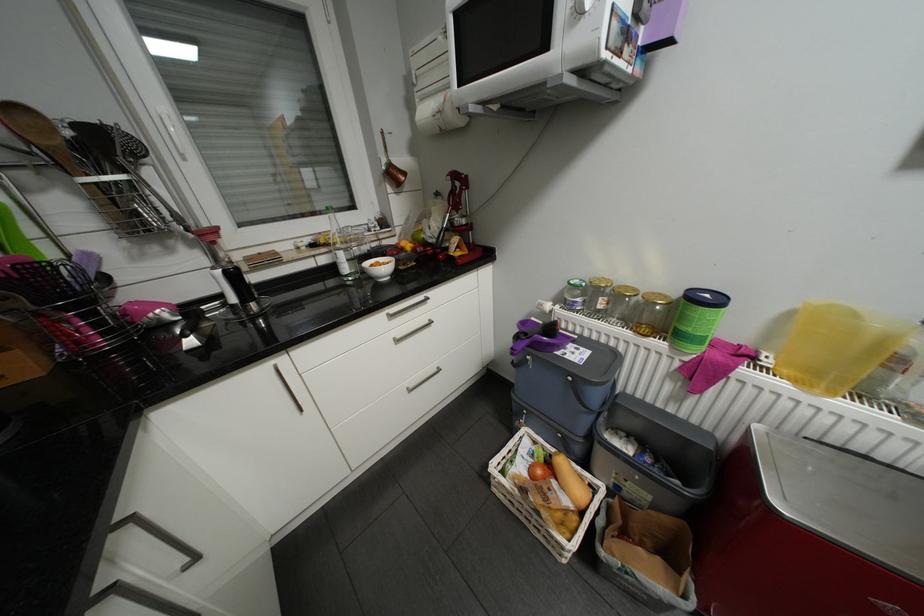
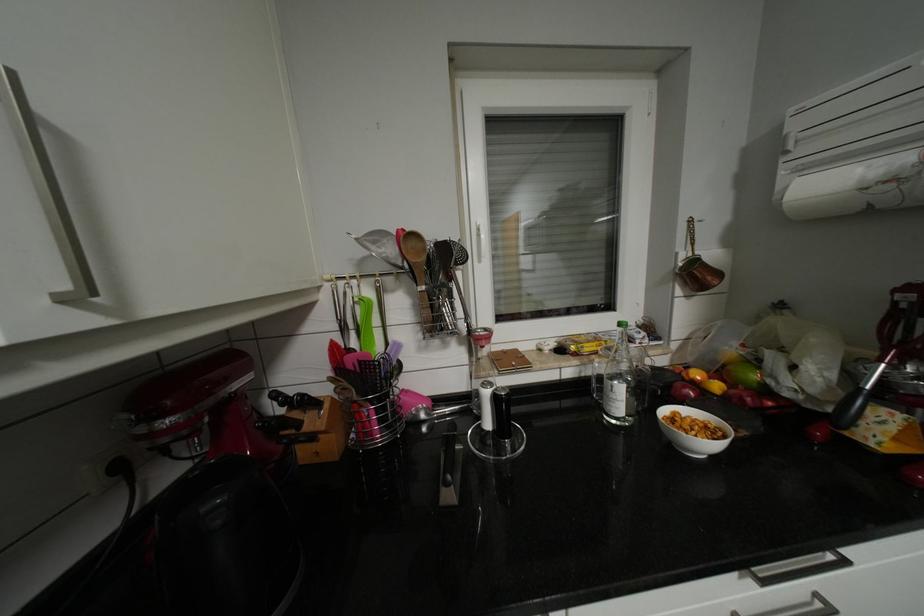
In the second image, find the point that corresponds to the point at 410,243 in the first image.

(704, 374)